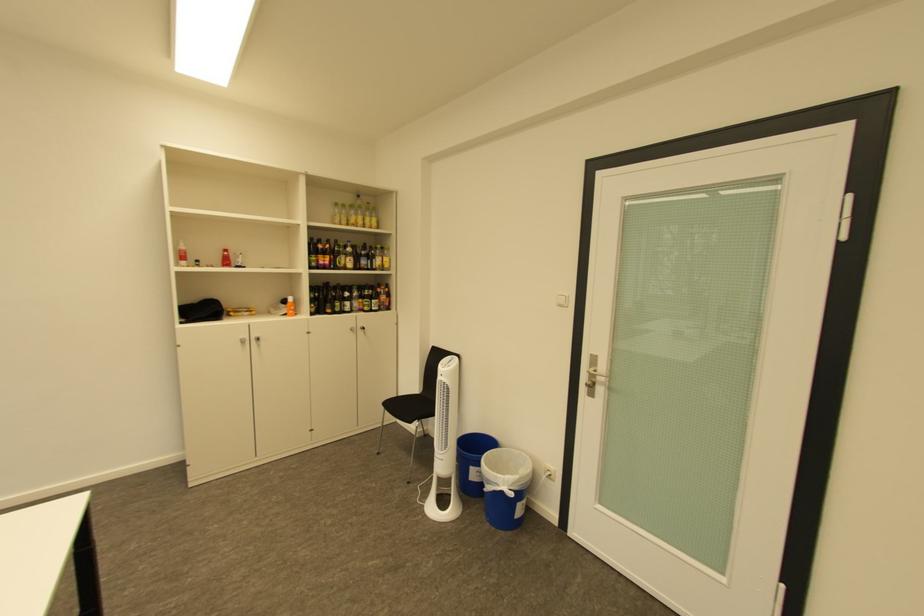
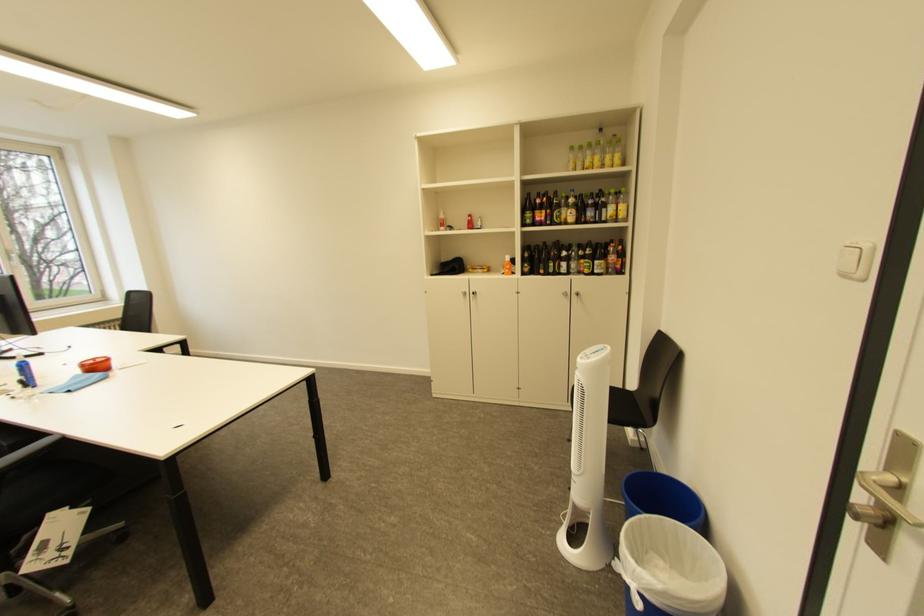
The point at [569,306] is marked in the first image. Where is the corresponding point in the second image?

(855, 277)